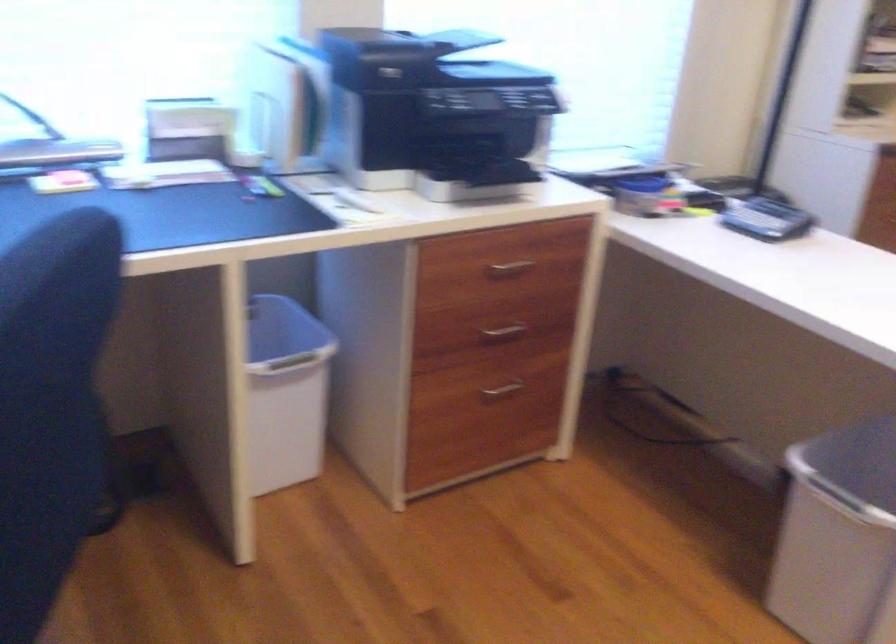
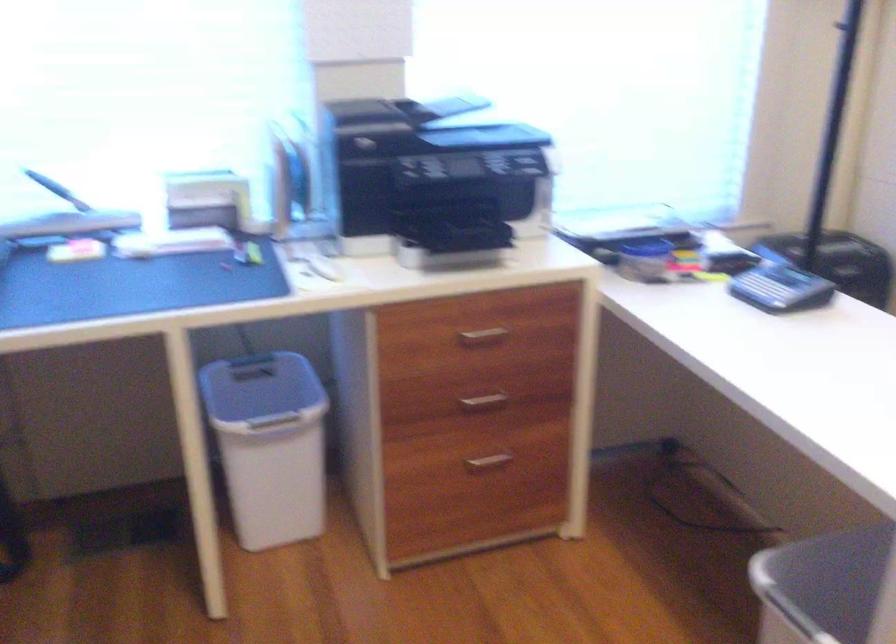
Where in the second image is the point corresponding to pixel 772 218 from the first image?

(780, 288)